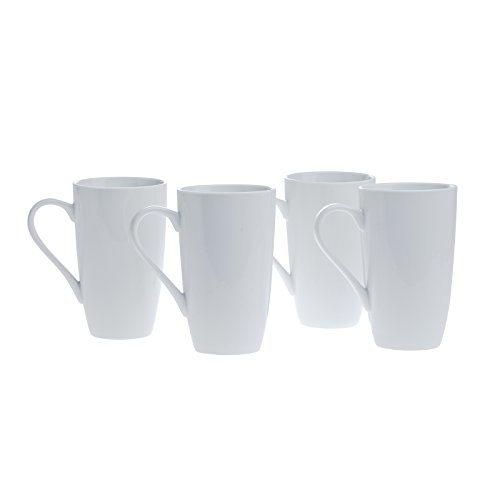
Locate an element on the screen. coffee mugs is located at coordinates (142, 316), (234, 294), (317, 297), (392, 309).